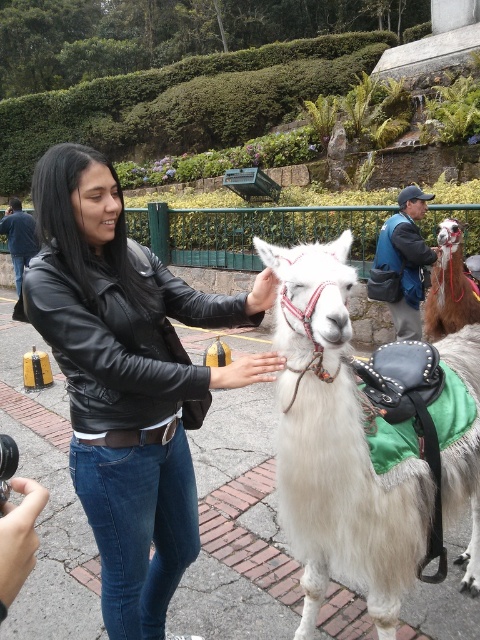
Is white woolen camel at center in front of matte black hand at upper center?

Yes, it is in front of matte black hand at upper center.

Is point (290, 284) positioned in front of point (264, 296)?

Yes, it is.

Locate an element on the screen. Image resolution: width=480 pixels, height=640 pixels. white woolen camel at center is located at coordinates (339, 448).

Is point (95, 156) closer to camera compared to point (19, 243)?

Yes, point (95, 156) is in front of point (19, 243).

Does black leather jacket at center have a smaller size compared to black leather jacket at upper left?

No.

Is point (48, 294) more distant than point (14, 244)?

No, (48, 294) is closer to viewer.

Image resolution: width=480 pixels, height=640 pixels. I want to click on black leather jacket at center, so click(122, 381).

Who is higher up, blue denim jacket at center or black leather jacket at upper left?

black leather jacket at upper left

In the scene shown: Does blue denim jacket at center appear under black leather jacket at upper left?

Indeed, blue denim jacket at center is positioned under black leather jacket at upper left.

Which is in front, point (419, 188) or point (21, 241)?

Point (419, 188) is more forward.

This screenshot has width=480, height=640. Find the location of `blue denim jacket at center`. blue denim jacket at center is located at coordinates (403, 262).